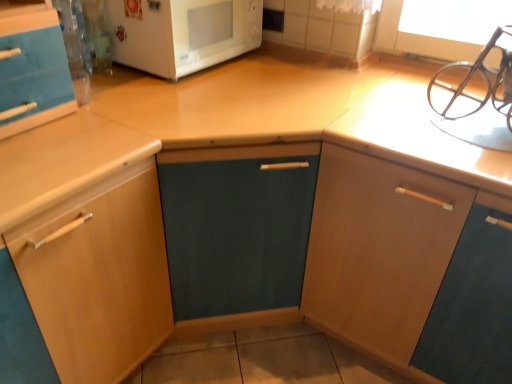
Image resolution: width=512 pixels, height=384 pixels. I want to click on white glossy microwave at upper center, so click(x=182, y=33).

The width and height of the screenshot is (512, 384). What do you see at coordinates (379, 249) in the screenshot?
I see `wooden cabinet at upper right, which appears as the 2th cabinetry when viewed from the left` at bounding box center [379, 249].

This screenshot has width=512, height=384. I want to click on wooden cabinet at upper right, the 1th cabinetry viewed from the right, so click(x=379, y=249).

You are a GUI agent. You are given a task and a screenshot of the screen. Output one action in this format:
    pyautogui.click(x=<x>, y=<y>)
    Task: Click on the metallic silver sink at upper right
    Image resolution: width=512 pixels, height=384 pixels.
    Given the screenshot: What is the action you would take?
    475,97

Measure the distance between point (495,31) and camera.

4.54 feet.

I want to click on white glossy microwave at upper center, so click(x=182, y=33).

Can you confirm if wooden cabinet at left, positioned as the 1th cabinetry in left-to-right order, is shorter than white glossy microwave at upper center?

No, wooden cabinet at left, positioned as the 1th cabinetry in left-to-right order, is not shorter than white glossy microwave at upper center.

Who is more distant, wooden cabinet at left, the second cabinetry viewed from the right, or white glossy microwave at upper center?

white glossy microwave at upper center.

Does wooden cabinet at left, the second cabinetry viewed from the right, have a greater width compared to white glossy microwave at upper center?

Yes, wooden cabinet at left, the second cabinetry viewed from the right, is wider than white glossy microwave at upper center.

Do you think wooden cabinet at left, the second cabinetry viewed from the right, is within white glossy microwave at upper center, or outside of it?

wooden cabinet at left, the second cabinetry viewed from the right, is outside white glossy microwave at upper center.

Is metallic silver sink at upper right completely or partially outside of white glossy microwave at upper center?

Yes, metallic silver sink at upper right is outside of white glossy microwave at upper center.

Is white glossy microwave at upper center at the back of metallic silver sink at upper right?

No, white glossy microwave at upper center is not at the back of metallic silver sink at upper right.

Identify the location of microwave oven behind the metallic silver sink at upper right. Image resolution: width=512 pixels, height=384 pixels. (182, 33).

From the image's perspective, is wooden cabinet at upper right, the 1th cabinetry viewed from the right, above or below metallic silver sink at upper right?

Clearly, from the image's perspective, wooden cabinet at upper right, the 1th cabinetry viewed from the right, is below metallic silver sink at upper right.

Image resolution: width=512 pixels, height=384 pixels. Identify the location of sink lying above the wooden cabinet at upper right, the 1th cabinetry viewed from the right (from the image's perspective). (475, 97).

From a real-world perspective, who is located lower, wooden cabinet at upper right, which appears as the 2th cabinetry when viewed from the left, or metallic silver sink at upper right?

In real-world perspective, wooden cabinet at upper right, which appears as the 2th cabinetry when viewed from the left, is lower.

Based on the photo, can you confirm if wooden cabinet at upper right, the 1th cabinetry viewed from the right, is wider than metallic silver sink at upper right?

Correct, the width of wooden cabinet at upper right, the 1th cabinetry viewed from the right, exceeds that of metallic silver sink at upper right.

Consider the image. Looking at the image, does wooden cabinet at upper right, the 1th cabinetry viewed from the right, seem bigger or smaller compared to white glossy microwave at upper center?

In the image, wooden cabinet at upper right, the 1th cabinetry viewed from the right, appears to be larger than white glossy microwave at upper center.

Is there a large distance between wooden cabinet at upper right, the 1th cabinetry viewed from the right, and white glossy microwave at upper center?

No.

Considering the sizes of objects wooden cabinet at upper right, the 1th cabinetry viewed from the right, and white glossy microwave at upper center in the image provided, who is shorter, wooden cabinet at upper right, the 1th cabinetry viewed from the right, or white glossy microwave at upper center?

white glossy microwave at upper center.

From a real-world perspective, who is located lower, wooden cabinet at upper right, which appears as the 2th cabinetry when viewed from the left, or white glossy microwave at upper center?

wooden cabinet at upper right, which appears as the 2th cabinetry when viewed from the left, is physically lower.

Does white glossy microwave at upper center come in front of metallic silver sink at upper right?

No, white glossy microwave at upper center is further to the viewer.

Who is bigger, white glossy microwave at upper center or metallic silver sink at upper right?

white glossy microwave at upper center.

Consider the image. From the image's perspective, is white glossy microwave at upper center above or below metallic silver sink at upper right?

Clearly, from the image's perspective, white glossy microwave at upper center is above metallic silver sink at upper right.

Is wooden cabinet at upper right, which appears as the 2th cabinetry when viewed from the left, at the back of metallic silver sink at upper right?

No, metallic silver sink at upper right's orientation is not away from wooden cabinet at upper right, which appears as the 2th cabinetry when viewed from the left.

How different are the orientations of metallic silver sink at upper right and wooden cabinet at upper right, which appears as the 2th cabinetry when viewed from the left, in degrees?

The facing directions of metallic silver sink at upper right and wooden cabinet at upper right, which appears as the 2th cabinetry when viewed from the left, are 0.00134 degrees apart.

Considering the points (495, 142) and (327, 281), which point is in front, point (495, 142) or point (327, 281)?

The point (495, 142) is closer.

Can you confirm if metallic silver sink at upper right is shorter than wooden cabinet at upper right, the 1th cabinetry viewed from the right?

Indeed, metallic silver sink at upper right has a lesser height compared to wooden cabinet at upper right, the 1th cabinetry viewed from the right.

From a real-world perspective, who is located lower, white glossy microwave at upper center or wooden cabinet at left, positioned as the 1th cabinetry in left-to-right order?

In real-world perspective, wooden cabinet at left, positioned as the 1th cabinetry in left-to-right order, is lower.

The image size is (512, 384). Identify the location of microwave oven behind the wooden cabinet at left, the second cabinetry viewed from the right. [182, 33].

Considering the sizes of objects white glossy microwave at upper center and wooden cabinet at left, the second cabinetry viewed from the right, in the image provided, who is taller, white glossy microwave at upper center or wooden cabinet at left, the second cabinetry viewed from the right,?

Standing taller between the two is wooden cabinet at left, the second cabinetry viewed from the right.

Which of these two, white glossy microwave at upper center or wooden cabinet at left, positioned as the 1th cabinetry in left-to-right order, is thinner?

white glossy microwave at upper center.

Starting from the white glossy microwave at upper center, which cabinetry is the 2nd one in front? Please provide its 2D coordinates.

[(88, 243)]

Find the location of a particular element. The width and height of the screenshot is (512, 384). microwave oven above the metallic silver sink at upper right (from the image's perspective) is located at coordinates pos(182,33).

When comparing their distances from white glossy microwave at upper center, does metallic silver sink at upper right or wooden cabinet at upper right, the 1th cabinetry viewed from the right, seem further?

Among the two, metallic silver sink at upper right is located further to white glossy microwave at upper center.

From the image, which object appears to be nearer to metallic silver sink at upper right, wooden cabinet at left, positioned as the 1th cabinetry in left-to-right order, or wooden cabinet at upper right, which appears as the 2th cabinetry when viewed from the left?

wooden cabinet at upper right, which appears as the 2th cabinetry when viewed from the left.

Estimate the real-world distances between objects in this image. Which object is closer to wooden cabinet at left, the second cabinetry viewed from the right, white glossy microwave at upper center or wooden cabinet at upper right, which appears as the 2th cabinetry when viewed from the left?

Among the two, white glossy microwave at upper center is located nearer to wooden cabinet at left, the second cabinetry viewed from the right.

Looking at the image, which one is located further to metallic silver sink at upper right, wooden cabinet at upper right, which appears as the 2th cabinetry when viewed from the left, or white glossy microwave at upper center?

white glossy microwave at upper center lies further to metallic silver sink at upper right than the other object.

From the picture: From the image, which object appears to be nearer to wooden cabinet at upper right, the 1th cabinetry viewed from the right, wooden cabinet at left, the second cabinetry viewed from the right, or white glossy microwave at upper center?

wooden cabinet at left, the second cabinetry viewed from the right, lies closer to wooden cabinet at upper right, the 1th cabinetry viewed from the right, than the other object.

From the image, which object appears to be nearer to wooden cabinet at upper right, which appears as the 2th cabinetry when viewed from the left, wooden cabinet at left, positioned as the 1th cabinetry in left-to-right order, or metallic silver sink at upper right?

metallic silver sink at upper right is closer to wooden cabinet at upper right, which appears as the 2th cabinetry when viewed from the left.

Based on their spatial positions, is white glossy microwave at upper center or wooden cabinet at left, the second cabinetry viewed from the right, further from metallic silver sink at upper right?

The object further to metallic silver sink at upper right is wooden cabinet at left, the second cabinetry viewed from the right.

Considering their positions, is wooden cabinet at left, the second cabinetry viewed from the right, positioned closer to metallic silver sink at upper right than white glossy microwave at upper center?

Among the two, white glossy microwave at upper center is located nearer to metallic silver sink at upper right.

Where is `microwave oven between wooden cabinet at left, the second cabinetry viewed from the right, and wooden cabinet at upper right, the 1th cabinetry viewed from the right`? microwave oven between wooden cabinet at left, the second cabinetry viewed from the right, and wooden cabinet at upper right, the 1th cabinetry viewed from the right is located at coordinates (182, 33).

Image resolution: width=512 pixels, height=384 pixels. I want to click on sink between wooden cabinet at left, positioned as the 1th cabinetry in left-to-right order, and wooden cabinet at upper right, the 1th cabinetry viewed from the right, so click(475, 97).

This screenshot has height=384, width=512. In order to click on sink between white glossy microwave at upper center and wooden cabinet at upper right, the 1th cabinetry viewed from the right, from left to right in this screenshot , I will do `click(475, 97)`.

This screenshot has width=512, height=384. Find the location of `microwave oven between wooden cabinet at left, positioned as the 1th cabinetry in left-to-right order, and metallic silver sink at upper right`. microwave oven between wooden cabinet at left, positioned as the 1th cabinetry in left-to-right order, and metallic silver sink at upper right is located at coordinates (182, 33).